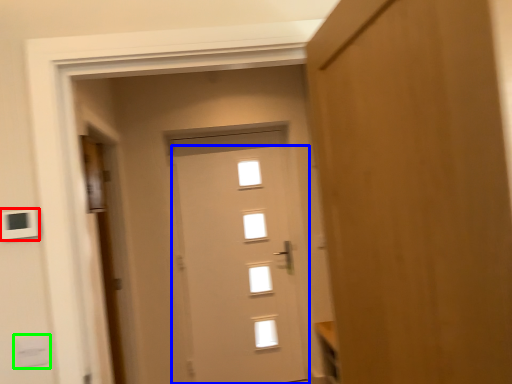
Question: Estimate the real-world distances between objects in this image. Which object is farther from light switch (highlighted by a red box), door (highlighted by a blue box) or light switch (highlighted by a green box)?

Choices:
 (A) door
 (B) light switch

Answer: (A)